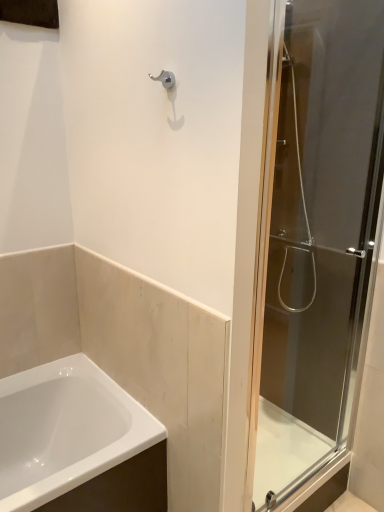
Question: Does point (269, 289) appear closer or farther from the camera than point (49, 505)?

Choices:
 (A) closer
 (B) farther

Answer: (B)

Question: In the image, is transparent glass shower door at right on the left side or the right side of white glossy bathtub at lower left?

Choices:
 (A) right
 (B) left

Answer: (A)

Question: Which is correct: transparent glass shower door at right is inside white glossy bathtub at lower left, or outside of it?

Choices:
 (A) outside
 (B) inside

Answer: (A)

Question: Considering the positions of point (69, 376) and point (316, 83), is point (69, 376) closer or farther from the camera than point (316, 83)?

Choices:
 (A) closer
 (B) farther

Answer: (B)

Question: In the image, is white glossy bathtub at lower left positioned in front of or behind transparent glass shower door at right?

Choices:
 (A) front
 (B) behind

Answer: (B)

Question: Considering the positions of white glossy bathtub at lower left and transparent glass shower door at right in the image, is white glossy bathtub at lower left wider or thinner than transparent glass shower door at right?

Choices:
 (A) wide
 (B) thin

Answer: (A)

Question: In terms of height, does white glossy bathtub at lower left look taller or shorter compared to transparent glass shower door at right?

Choices:
 (A) tall
 (B) short

Answer: (B)